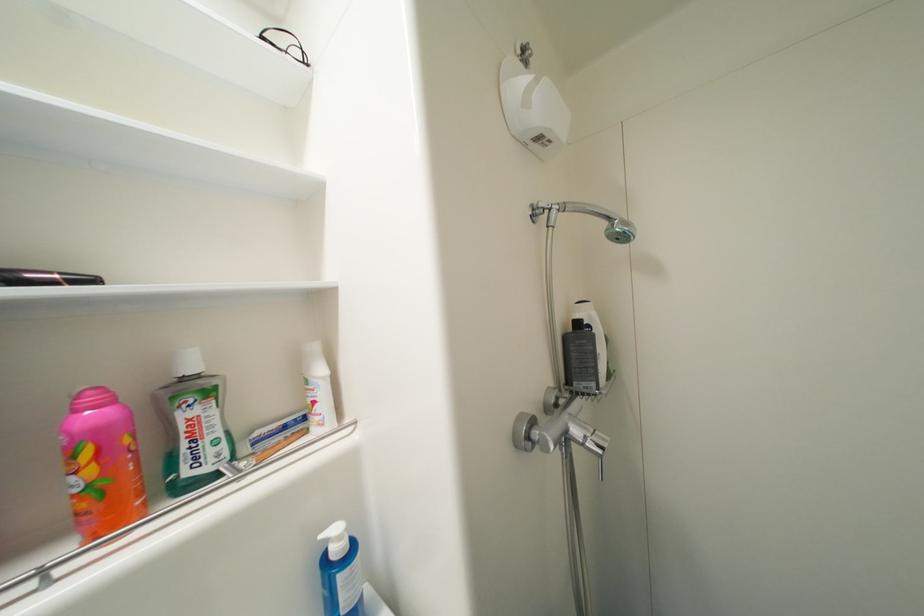
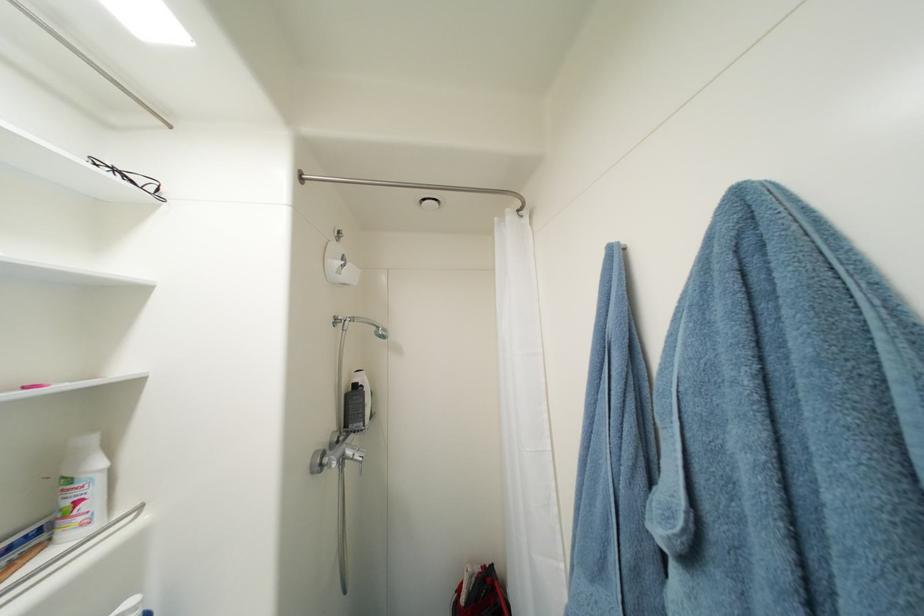
In the second image, find the point that corresponds to (585,326) in the first image.

(361, 387)